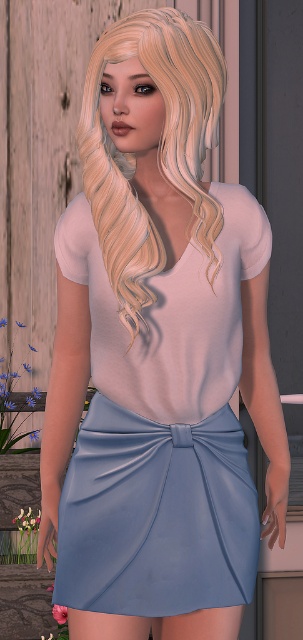
You are a photographer setting up a shoot in this scene. You want to ensure that both the satin blue skirt at center and the blondehair at center are clearly visible in the photo. Based on their positions, which object should you adjust to avoid one blocking the other?

The blondehair at center is behind the satin blue skirt at center. To ensure both are visible, you should adjust the position of the blondehair at center so it is no longer obscured by the skirt.

You are a fashion designer observing the outfit of the person in the image. Which item, the satin blue skirt at center or the blondehair at center, is shorter in height?

The satin blue skirt at center has a lesser height compared to blondehair at center, so the satin blue skirt at center is shorter in height.

You are a fashion designer observing the image. You need to determine the correct order of the items from top to bottom. Which item is positioned lower between the satin blue skirt at center and the blondehair at center?

The satin blue skirt at center is located below blondehair at center, so the satin blue skirt at center is positioned lower than the blondehair at center.